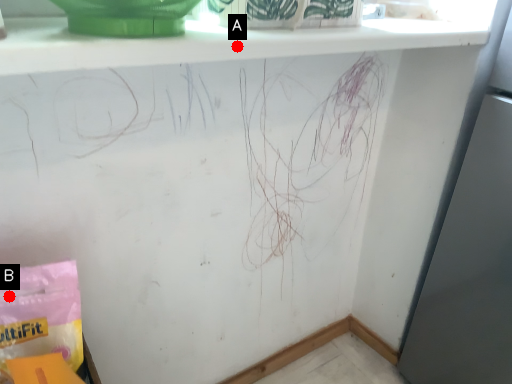
Question: Two points are circled on the image, labeled by A and B beside each circle. Which point is closer to the camera?

Choices:
 (A) A is closer
 (B) B is closer

Answer: (A)